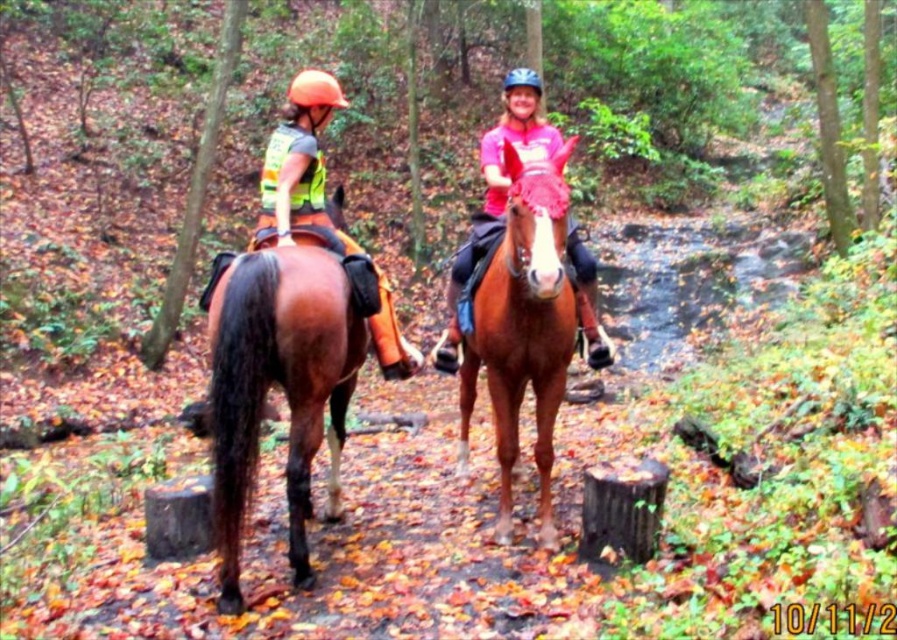
You are a photographer standing at the center of the forest path. You want to take a photo of the brown glossy horse at left and the pink matte helmet at upper center. If your camera has a maximum focus range of 5 feet, will both subjects be in focus?

The distance between the brown glossy horse at left and the pink matte helmet at upper center is 4.91 feet, which is within the camera maximum focus range of 5 feet. Therefore, both subjects will be in focus.

You are a photographer trying to capture a photo of the brown glossy horse at left and the pink matte helmet at upper center. Based on their positions, which object should you focus on first to ensure both are in frame?

The brown glossy horse at left is below the pink matte helmet at upper center, so you should focus on the pink matte helmet at upper center first to ensure both are in frame.

You are a photographer trying to capture a photo of both the brown glossy horse at left and the brown glossy horse at center. Based on their positions, which horse should you focus on first to ensure both are in the frame?

You should focus on the brown glossy horse at left first because the brown glossy horse at center is behind it, so adjusting the frame to include the front horse will naturally include the one behind as well.